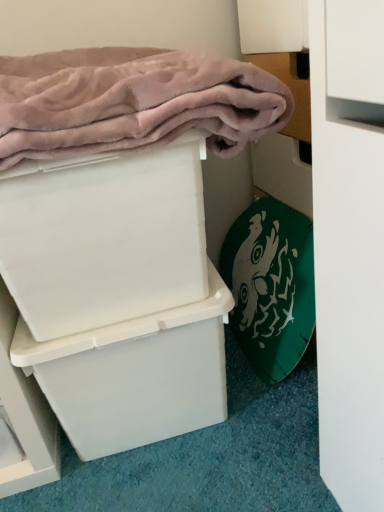
Question: Is pink plush bath towel at upper left, which ranks as the first bath towel in top-to-bottom order, next to green fabric bath towel at lower right, positioned as the second bath towel in top-to-bottom order, and touching it?

Choices:
 (A) yes
 (B) no

Answer: (B)

Question: Does pink plush bath towel at upper left, which is the first bath towel in left-to-right order, appear on the right side of green fabric bath towel at lower right, positioned as the second bath towel in top-to-bottom order?

Choices:
 (A) no
 (B) yes

Answer: (A)

Question: Is green fabric bath towel at lower right, which is counted as the first bath towel, starting from the right, completely or partially inside pink plush bath towel at upper left, which ranks as the first bath towel in top-to-bottom order?

Choices:
 (A) no
 (B) yes

Answer: (A)

Question: Is pink plush bath towel at upper left, the 2th bath towel from the right, facing away from green fabric bath towel at lower right, which appears as the second bath towel when viewed from the left?

Choices:
 (A) yes
 (B) no

Answer: (B)

Question: Does pink plush bath towel at upper left, which ranks as the first bath towel in top-to-bottom order, have a greater height compared to green fabric bath towel at lower right, which appears as the second bath towel when viewed from the left?

Choices:
 (A) yes
 (B) no

Answer: (B)

Question: Would you say white plastic box at center, the second box viewed from the top, is to the left or to the right of pink plush bath towel at upper left, which ranks as the first bath towel in top-to-bottom order, in the picture?

Choices:
 (A) right
 (B) left

Answer: (B)

Question: From a real-world perspective, is white plastic box at center, the second box viewed from the top, positioned above or below pink plush bath towel at upper left, the 2th bath towel from the right?

Choices:
 (A) above
 (B) below

Answer: (B)

Question: In terms of width, does white plastic box at center, the first box in the bottom-to-top sequence, look wider or thinner when compared to pink plush bath towel at upper left, which appears as the 2th bath towel when ordered from the bottom?

Choices:
 (A) wide
 (B) thin

Answer: (B)

Question: Choose the correct answer: Is white plastic box at center, the first box in the bottom-to-top sequence, inside pink plush bath towel at upper left, the 2th bath towel from the right, or outside it?

Choices:
 (A) outside
 (B) inside

Answer: (A)

Question: Relative to white plastic box at upper left, which is counted as the 2th box, starting from the bottom, is white plastic box at center, the first box in the bottom-to-top sequence, in front or behind?

Choices:
 (A) behind
 (B) front

Answer: (A)

Question: Choose the correct answer: Is white plastic box at center, the second box viewed from the top, inside white plastic box at upper left, which is counted as the 2th box, starting from the bottom, or outside it?

Choices:
 (A) inside
 (B) outside

Answer: (B)

Question: In terms of width, does white plastic box at center, the second box viewed from the top, look wider or thinner when compared to white plastic box at upper left, which is counted as the 2th box, starting from the bottom?

Choices:
 (A) thin
 (B) wide

Answer: (B)

Question: From the image's perspective, is white plastic box at center, the second box viewed from the top, above or below white plastic box at upper left, which is counted as the 2th box, starting from the bottom?

Choices:
 (A) above
 (B) below

Answer: (B)

Question: Is point (36, 310) positioned closer to the camera than point (92, 457)?

Choices:
 (A) closer
 (B) farther

Answer: (A)

Question: Visually, is white plastic box at upper left, which is counted as the 2th box, starting from the bottom, positioned to the left or to the right of white plastic box at center, the second box viewed from the top?

Choices:
 (A) left
 (B) right

Answer: (A)